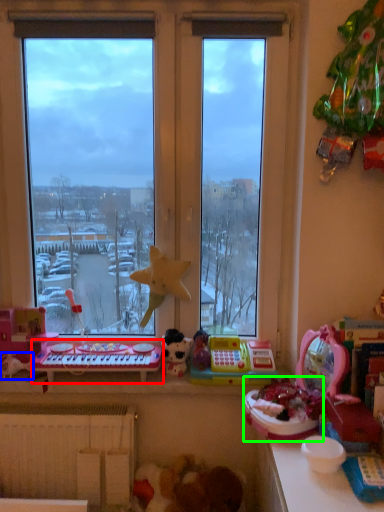
Question: Which is nearer to the musical keyboard (highlighted by a red box)? toy (highlighted by a blue box) or toy (highlighted by a green box).

Choices:
 (A) toy
 (B) toy

Answer: (A)